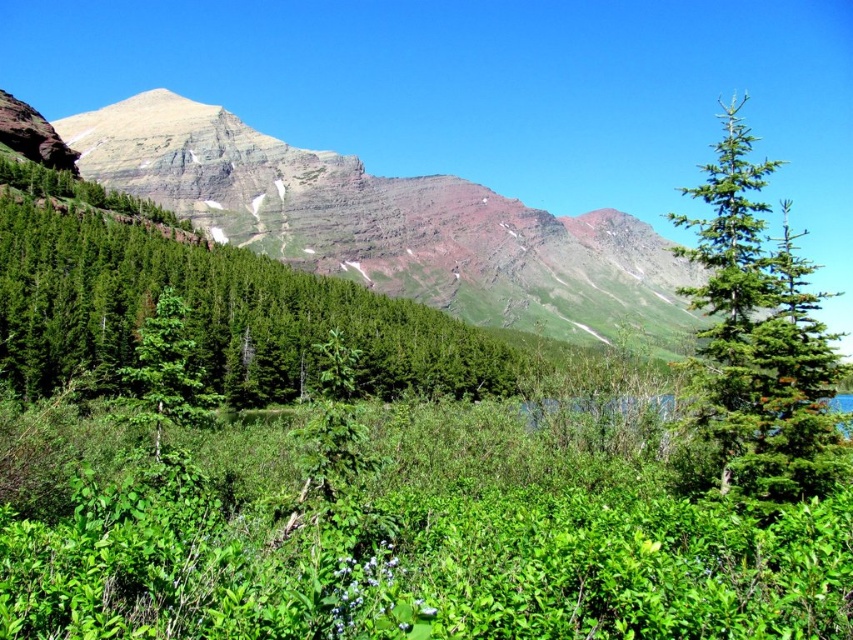
Is green needle-like at right bigger than green matte tree at center-left?

Yes.

Is point (699, 221) in front of point (131, 369)?

No, (699, 221) is behind (131, 369).

From the picture: Who is more forward, (746, 436) or (138, 372)?

Point (746, 436)

This screenshot has height=640, width=853. I want to click on green needle-like at right, so click(x=758, y=339).

Which is in front, point (201, 108) or point (166, 356)?

Point (166, 356)

Describe the element at coordinates (393, 227) in the screenshot. The image size is (853, 640). I see `green grassy mountain at upper center` at that location.

Identify the location of green grassy mountain at upper center. The image size is (853, 640). click(393, 227).

Between green matte tree at center and green matte tree at center-left, which one is positioned lower?

green matte tree at center-left

Is point (428, 328) positioned in front of point (173, 360)?

No, (428, 328) is further to viewer.

The width and height of the screenshot is (853, 640). I want to click on green matte tree at center, so click(x=202, y=305).